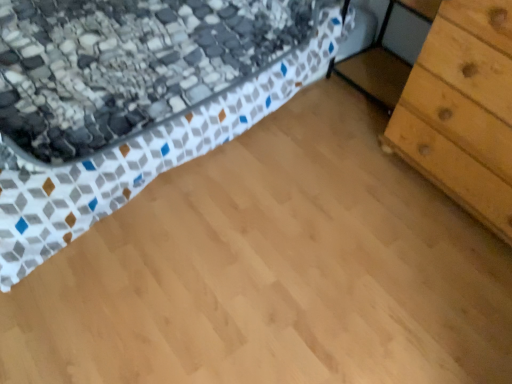
Image resolution: width=512 pixels, height=384 pixels. What do you see at coordinates (463, 110) in the screenshot? I see `light brown wood chest of drawers at right` at bounding box center [463, 110].

In order to face light brown wood chest of drawers at right, should I rotate leftwards or rightwards?

It's best to rotate right around 32.068 degrees.

At what (x,y) coordinates should I click in order to perform the action: click on light brown wood chest of drawers at right. Please return your answer as a coordinate pair (x, y). The image size is (512, 384). Looking at the image, I should click on (463, 110).

What do you see at coordinates (145, 157) in the screenshot?
I see `textured fabric bed at upper left` at bounding box center [145, 157].

Where is `textured fabric bed at upper left`? The height and width of the screenshot is (384, 512). textured fabric bed at upper left is located at coordinates (145, 157).

What are the coordinates of `light brown wood chest of drawers at right` in the screenshot? It's located at (463, 110).

Does light brown wood chest of drawers at right appear on the right side of textured fabric bed at upper left?

Correct, you'll find light brown wood chest of drawers at right to the right of textured fabric bed at upper left.

Which is in front, light brown wood chest of drawers at right or textured fabric bed at upper left?

textured fabric bed at upper left is closer to the camera.

Which is in front, point (446, 47) or point (275, 108)?

The point (446, 47) is more forward.

From the image's perspective, between light brown wood chest of drawers at right and textured fabric bed at upper left, who is located below?

light brown wood chest of drawers at right appears lower in the image.

From a real-world perspective, between light brown wood chest of drawers at right and textured fabric bed at upper left, who is vertically higher?

light brown wood chest of drawers at right, from a real-world perspective.

Looking at this image, considering the sizes of objects light brown wood chest of drawers at right and textured fabric bed at upper left in the image provided, who is thinner, light brown wood chest of drawers at right or textured fabric bed at upper left?

With smaller width is light brown wood chest of drawers at right.

Who is taller, light brown wood chest of drawers at right or textured fabric bed at upper left?

Standing taller between the two is light brown wood chest of drawers at right.

Can you confirm if light brown wood chest of drawers at right is smaller than textured fabric bed at upper left?

Indeed, light brown wood chest of drawers at right has a smaller size compared to textured fabric bed at upper left.

Consider the image. Is light brown wood chest of drawers at right inside the boundaries of textured fabric bed at upper left, or outside?

light brown wood chest of drawers at right exists outside the volume of textured fabric bed at upper left.

Is light brown wood chest of drawers at right far away from textured fabric bed at upper left?

light brown wood chest of drawers at right is actually quite close to textured fabric bed at upper left.

Is light brown wood chest of drawers at right oriented towards textured fabric bed at upper left?

No, light brown wood chest of drawers at right is not oriented towards textured fabric bed at upper left.

Can you tell me how much light brown wood chest of drawers at right and textured fabric bed at upper left differ in facing direction?

The facing directions of light brown wood chest of drawers at right and textured fabric bed at upper left are 0.297 degrees apart.

Locate an element on the screen. This screenshot has width=512, height=384. bed lying in front of the light brown wood chest of drawers at right is located at coordinates (145, 157).

Considering the positions of objects textured fabric bed at upper left and light brown wood chest of drawers at right in the image provided, who is more to the left, textured fabric bed at upper left or light brown wood chest of drawers at right?

textured fabric bed at upper left is more to the left.

Considering the positions of objects textured fabric bed at upper left and light brown wood chest of drawers at right in the image provided, who is behind, textured fabric bed at upper left or light brown wood chest of drawers at right?

light brown wood chest of drawers at right is further away from the camera.

Is point (128, 165) behind point (462, 22)?

Yes, point (128, 165) is behind point (462, 22).

From the image's perspective, is textured fabric bed at upper left located beneath light brown wood chest of drawers at right?

No, from the image's perspective, textured fabric bed at upper left is not beneath light brown wood chest of drawers at right.

From a real-world perspective, which is physically above, textured fabric bed at upper left or light brown wood chest of drawers at right?

light brown wood chest of drawers at right, from a real-world perspective.

Is textured fabric bed at upper left wider than light brown wood chest of drawers at right?

Indeed, textured fabric bed at upper left has a greater width compared to light brown wood chest of drawers at right.

In the scene shown: Is textured fabric bed at upper left shorter than light brown wood chest of drawers at right?

Yes.

Can you confirm if textured fabric bed at upper left is smaller than light brown wood chest of drawers at right?

No, textured fabric bed at upper left is not smaller than light brown wood chest of drawers at right.

Is light brown wood chest of drawers at right surrounded by textured fabric bed at upper left?

No, textured fabric bed at upper left does not contain light brown wood chest of drawers at right.

Is textured fabric bed at upper left far from light brown wood chest of drawers at right?

No, textured fabric bed at upper left is in close proximity to light brown wood chest of drawers at right.

Is textured fabric bed at upper left facing away from light brown wood chest of drawers at right?

No, light brown wood chest of drawers at right is not at the back of textured fabric bed at upper left.

Locate an element on the screen. This screenshot has width=512, height=384. chest of drawers above the textured fabric bed at upper left (from a real-world perspective) is located at coordinates (463, 110).

You are a GUI agent. You are given a task and a screenshot of the screen. Output one action in this format:
    pyautogui.click(x=<x>, y=<y>)
    Task: Click on the chest of drawers that is below the textured fabric bed at upper left (from the image's perspective)
    
    Given the screenshot: What is the action you would take?
    pyautogui.click(x=463, y=110)

I want to click on chest of drawers to the right of textured fabric bed at upper left, so click(x=463, y=110).